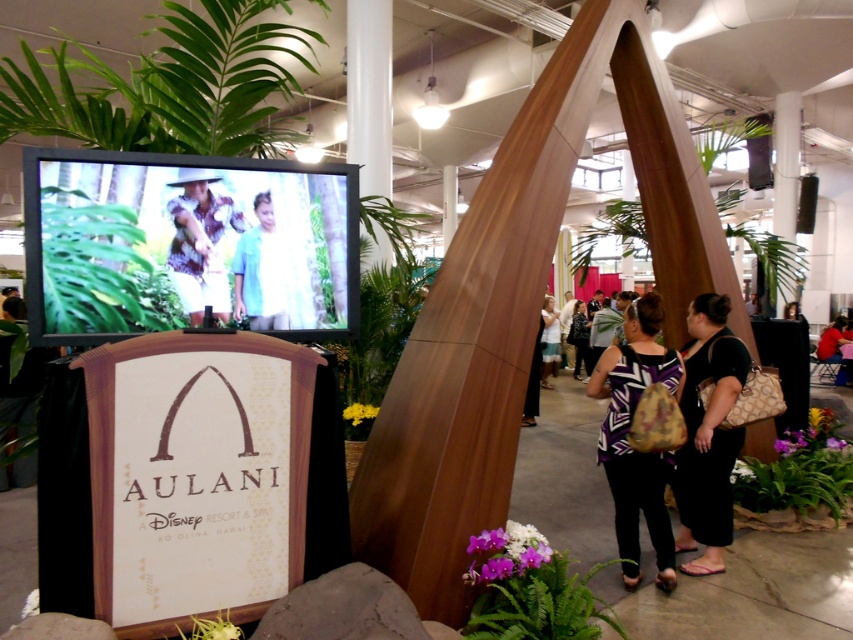
You are at the Aulani promotional display and want to take a photo of both the green leafy plant at upper center and the patterned fabric dress at center. Which object should you focus on first to ensure both are in clear view?

You should focus on the green leafy plant at upper center first because it is closer to you than the patterned fabric dress at center, ensuring both are in clear view when focused properly.

Based on the photo, you are at the Aulani promotional display and want to take a souvenir. The patterned fabric bag at center and the patterned fabric dress at center are both displayed. Which item would you need to handle with more care due to its size?

The patterned fabric bag at center is larger in size than the patterned fabric dress at center, so you would need to handle the patterned fabric bag at center with more care due to its size.